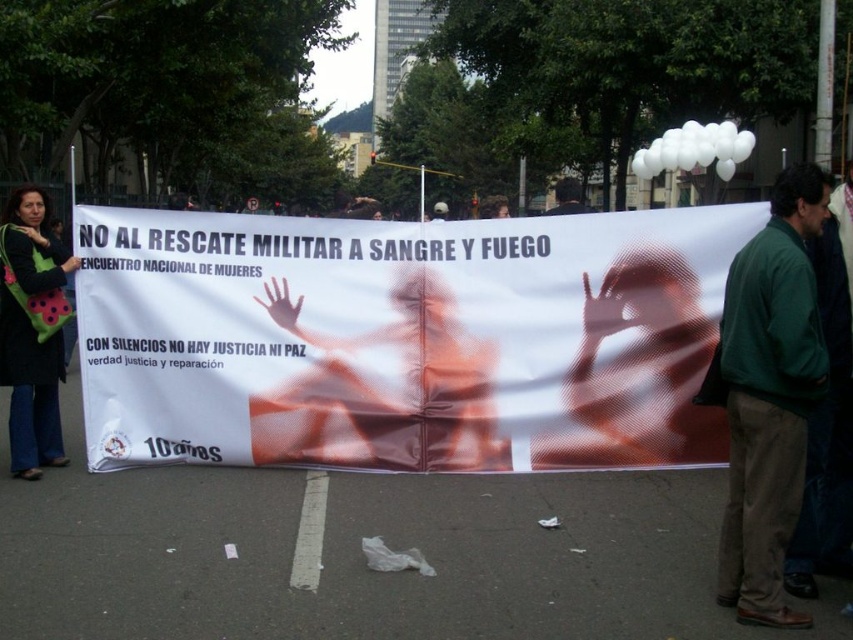
Question: Estimate the real-world distances between objects in this image. Which object is farther from the green fabric jacket at center?

Choices:
 (A) white paper banner at center
 (B) black felt bag at left
 (C) dark brown hair at upper center
 (D) dark green jacket at center

Answer: (D)

Question: Which of the following is the farthest from the observer?

Choices:
 (A) dark green jacket at center
 (B) dark brown hair at upper center
 (C) black felt bag at left

Answer: (A)

Question: Does green fabric jacket at center appear on the left side of dark green jacket at center?

Choices:
 (A) yes
 (B) no

Answer: (B)

Question: Is green fabric jacket at center further to the viewer compared to black felt bag at left?

Choices:
 (A) no
 (B) yes

Answer: (A)

Question: Does green fabric jacket at center appear under black felt bag at left?

Choices:
 (A) no
 (B) yes

Answer: (B)

Question: Which point is farther from the camera taking this photo?

Choices:
 (A) (430, 218)
 (B) (581, 200)
 (C) (15, 392)
 (D) (479, 394)

Answer: (A)